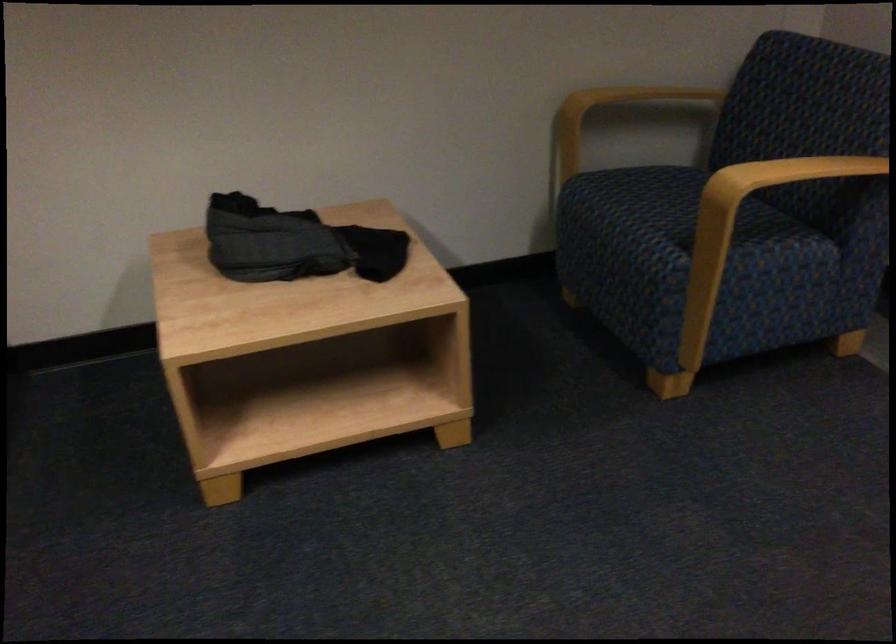
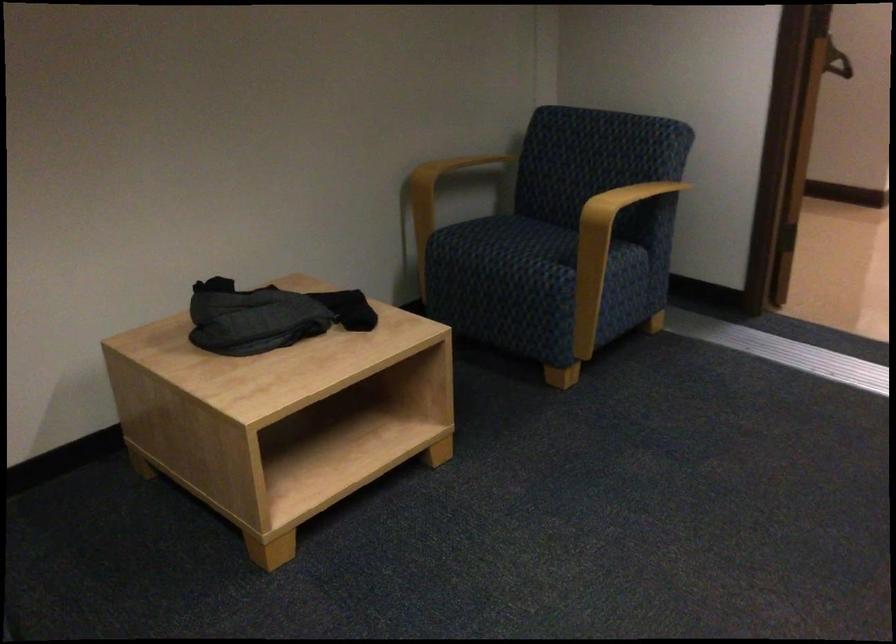
Find the pixel in the second image that matches the point at 610,118 in the first image.

(437, 187)